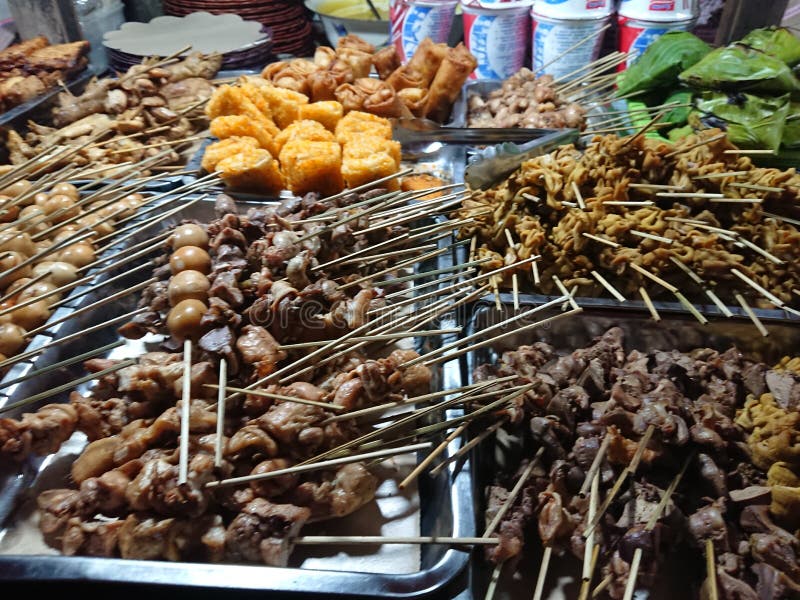
Find the location of a particular element. The image size is (800, 600). tin trays is located at coordinates (406, 560), (112, 244), (194, 169).